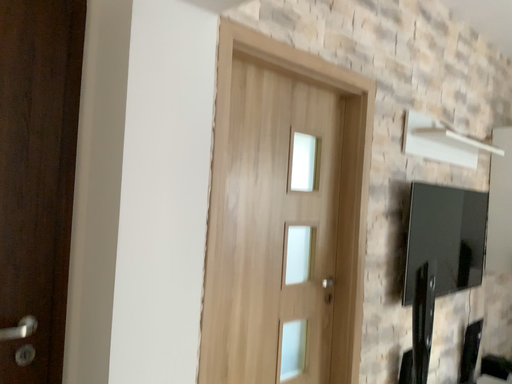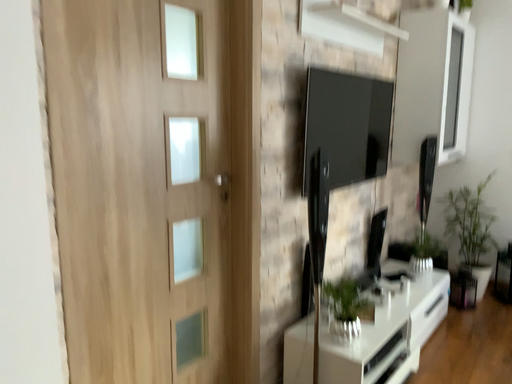
Question: How did the camera likely rotate when shooting the video?

Choices:
 (A) rotated left
 (B) rotated right

Answer: (B)